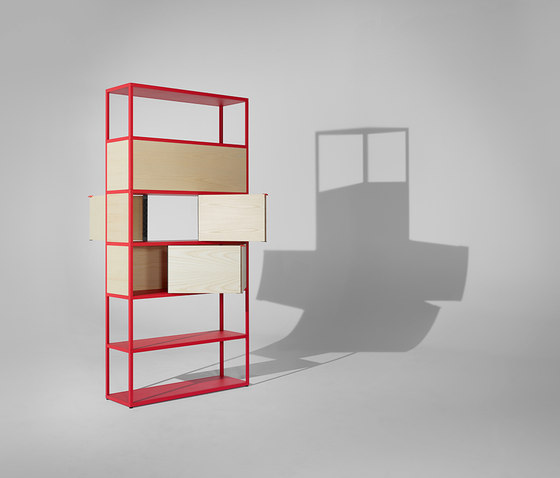
This screenshot has height=478, width=560. Find the location of `floor of a red shelf`. floor of a red shelf is located at coordinates point(170,388), point(169,341).